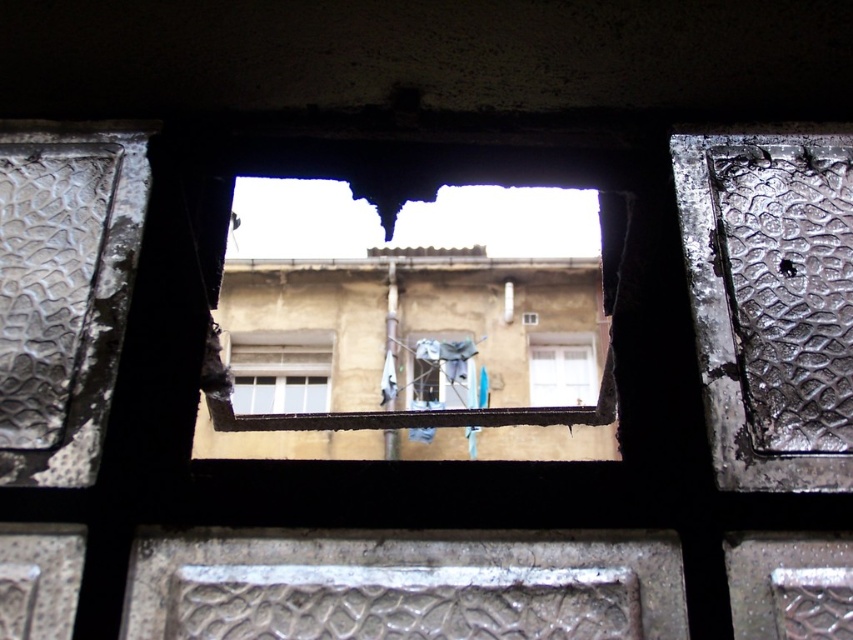
What do you see at coordinates (280, 371) in the screenshot? I see `white matte window at center` at bounding box center [280, 371].

Locate an element on the screen. This screenshot has width=853, height=640. white matte window at center is located at coordinates (280, 371).